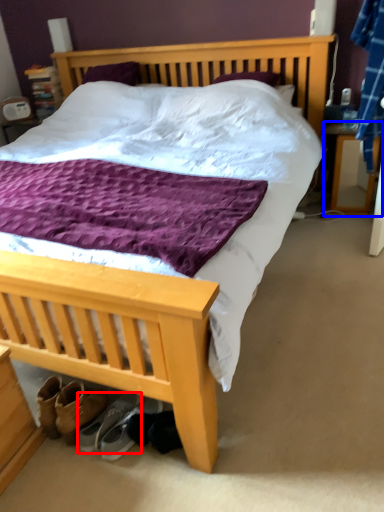
Question: Which object is closer to the camera taking this photo, footwear (highlighted by a red box) or nightstand (highlighted by a blue box)?

Choices:
 (A) footwear
 (B) nightstand

Answer: (A)